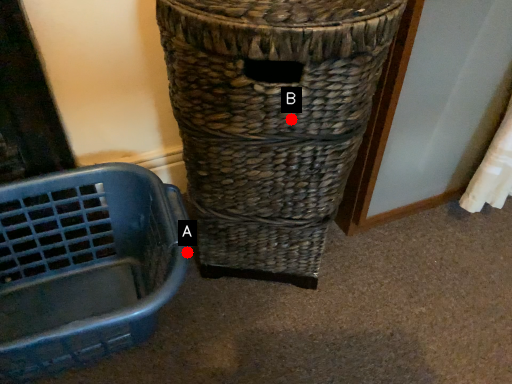
Question: Two points are circled on the image, labeled by A and B beside each circle. Which point is farther from the camera taking this photo?

Choices:
 (A) A is further
 (B) B is further

Answer: (A)